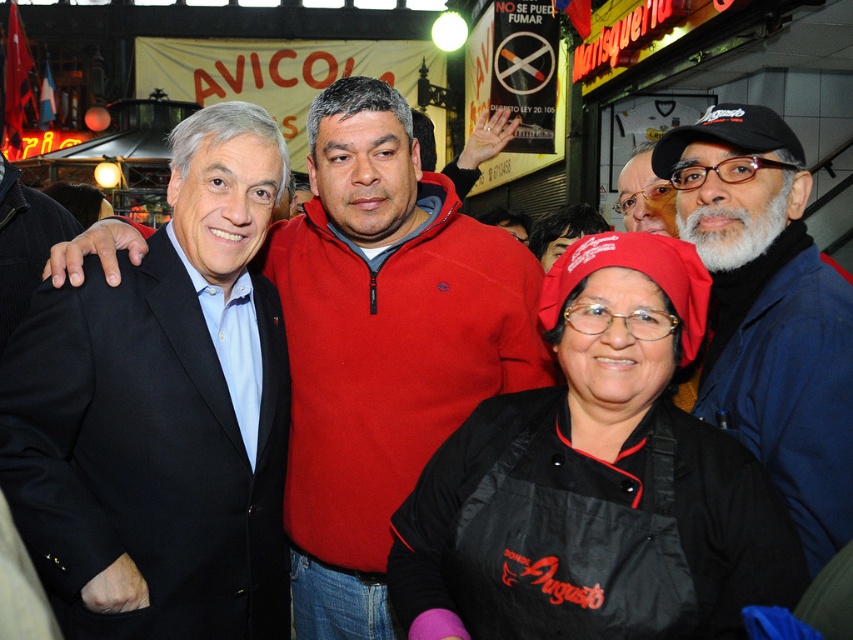
Question: Can you confirm if black matte suit at left is bigger than black fabric apron at center?

Choices:
 (A) no
 (B) yes

Answer: (B)

Question: Which point is farther from the camera taking this photo?

Choices:
 (A) (619, 176)
 (B) (552, 464)

Answer: (A)

Question: Among these points, which one is farthest from the camera?

Choices:
 (A) (306, 221)
 (B) (564, 456)
 (C) (138, 540)
 (D) (763, 417)

Answer: (A)

Question: Among these points, which one is farthest from the camera?

Choices:
 (A) (824, 352)
 (B) (402, 337)

Answer: (B)

Question: Is black matte suit at left positioned before matte black hat at upper right?

Choices:
 (A) no
 (B) yes

Answer: (B)

Question: Observing the image, what is the correct spatial positioning of black fabric apron at center in reference to matte black hat at upper right?

Choices:
 (A) right
 (B) left

Answer: (B)